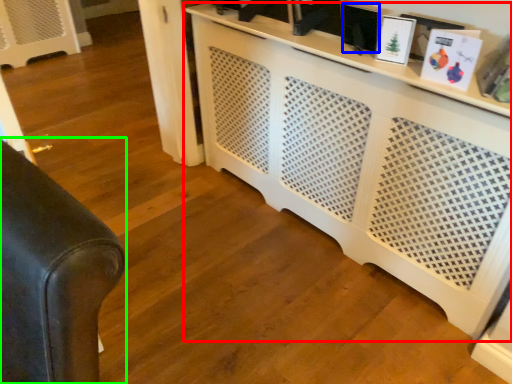
Question: Which object is the farthest from entertainment center (highlighted by a red box)? Choose among these: picture frame (highlighted by a blue box) or furniture (highlighted by a green box).

Choices:
 (A) picture frame
 (B) furniture

Answer: (B)